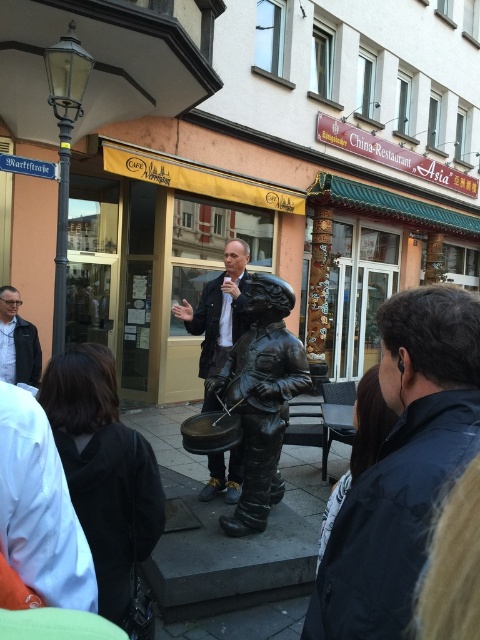
You are a tourist standing in the street scene and want to take a photo of the black stone statue at center and the matte black jacket at left. Which object should you position closer to the left side of the camera frame?

The matte black jacket at left should be positioned closer to the left side of the camera frame because the black stone statue at center is on the right side of it.

Looking at this image, you are a photographer trying to capture both the matte black jacket at center and the matte black jacket at left in the same frame. Based on their positions, can you determine which jacket is closer to the camera?

The matte black jacket at center is positioned over the matte black jacket at left, meaning it is closer to the camera.

You are a tourist standing in front of the building and see the bronze statue at center and the matte black jacket at center. Which object is located closer to you?

The bronze statue at center is positioned under matte black jacket at center, so the matte black jacket at center is closer to you.